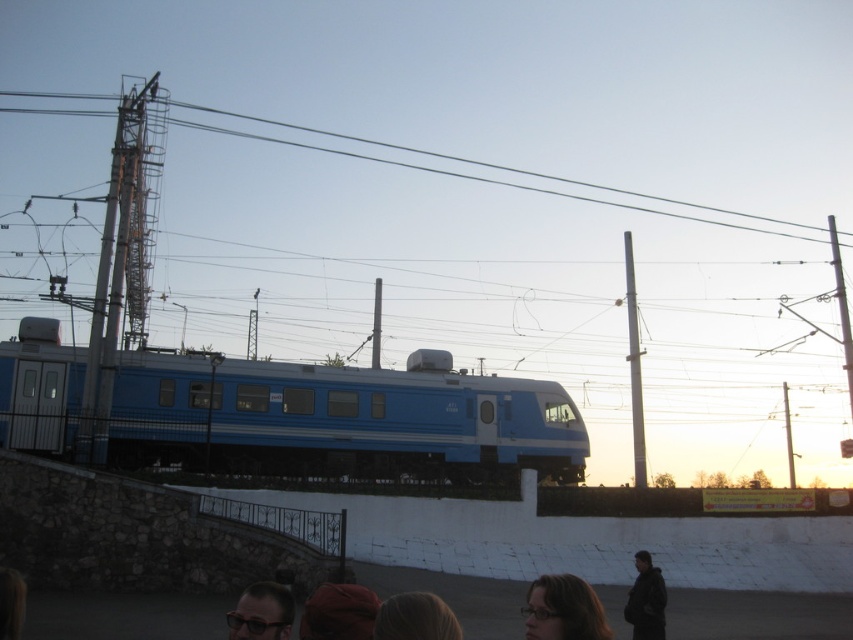
Can you confirm if matte black hair at lower center is positioned to the left of dark gray jacket at lower right?

Yes, matte black hair at lower center is to the left of dark gray jacket at lower right.

Does matte black hair at lower center have a larger size compared to dark gray jacket at lower right?

Correct, matte black hair at lower center is larger in size than dark gray jacket at lower right.

Is point (572, 621) farther from camera compared to point (664, 593)?

No, (572, 621) is closer to viewer.

You are a GUI agent. You are given a task and a screenshot of the screen. Output one action in this format:
    pyautogui.click(x=<x>, y=<y>)
    Task: Click on the matte black hair at lower center
    
    Given the screenshot: What is the action you would take?
    pyautogui.click(x=563, y=609)

Between blue glossy train at center and dark gray jacket at lower right, which one is positioned higher?

blue glossy train at center is higher up.

The height and width of the screenshot is (640, 853). What do you see at coordinates (340, 419) in the screenshot? I see `blue glossy train at center` at bounding box center [340, 419].

Find the location of a particular element. Image resolution: width=853 pixels, height=640 pixels. blue glossy train at center is located at coordinates (340, 419).

Can you confirm if blue glossy train at center is bigger than velvet brown hat at lower center?

Correct, blue glossy train at center is larger in size than velvet brown hat at lower center.

Find the location of a particular element. The width and height of the screenshot is (853, 640). blue glossy train at center is located at coordinates (340, 419).